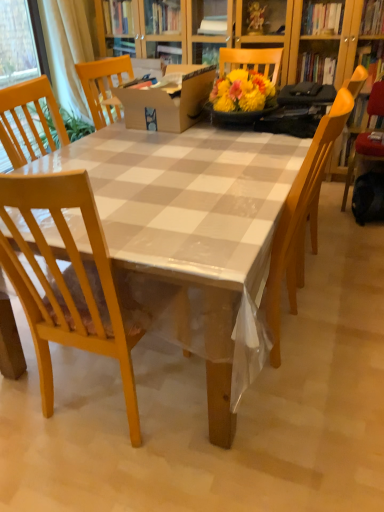
Question: From a real-world perspective, is yellow wood chair at right, placed as the first chair when sorted from right to left, physically below white sheer curtain at upper left?

Choices:
 (A) no
 (B) yes

Answer: (B)

Question: Is yellow wood chair at right, the third chair in the front-to-back sequence, in contact with white sheer curtain at upper left?

Choices:
 (A) no
 (B) yes

Answer: (A)

Question: Can you confirm if yellow wood chair at right, which appears as the 1th chair when viewed from the back, is shorter than white sheer curtain at upper left?

Choices:
 (A) no
 (B) yes

Answer: (B)

Question: Is the position of yellow wood chair at right, placed as the first chair when sorted from right to left, less distant than that of white sheer curtain at upper left?

Choices:
 (A) yes
 (B) no

Answer: (A)

Question: From a real-world perspective, is yellow wood chair at right, placed as the first chair when sorted from right to left, on white sheer curtain at upper left?

Choices:
 (A) yes
 (B) no

Answer: (B)

Question: Is yellow wood chair at right, which appears as the 1th chair when viewed from the back, at the left side of white sheer curtain at upper left?

Choices:
 (A) yes
 (B) no

Answer: (B)

Question: From a real-world perspective, is yellow wood chair at right, the third chair in the front-to-back sequence, on wooden chair at center, which appears as the second chair when viewed from the left?

Choices:
 (A) no
 (B) yes

Answer: (A)

Question: Is yellow wood chair at right, which appears as the 1th chair when viewed from the back, turned away from wooden chair at center, which appears as the second chair when viewed from the left?

Choices:
 (A) no
 (B) yes

Answer: (A)

Question: Considering the relative sizes of yellow wood chair at right, the 3th chair when ordered from left to right, and wooden chair at center, which appears as the second chair when viewed from the right, in the image provided, is yellow wood chair at right, the 3th chair when ordered from left to right, bigger than wooden chair at center, which appears as the second chair when viewed from the right,?

Choices:
 (A) yes
 (B) no

Answer: (B)

Question: Is yellow wood chair at right, placed as the first chair when sorted from right to left, positioned behind wooden chair at center, placed as the 2th chair when sorted from back to front?

Choices:
 (A) no
 (B) yes

Answer: (B)

Question: Can you confirm if yellow wood chair at right, which appears as the 1th chair when viewed from the back, is wider than wooden chair at center, which appears as the second chair when viewed from the right?

Choices:
 (A) no
 (B) yes

Answer: (B)

Question: Is wooden chair at center, which appears as the second chair when viewed from the right, a part of yellow wood chair at right, placed as the first chair when sorted from right to left?

Choices:
 (A) yes
 (B) no

Answer: (B)

Question: Is light wood chair at left, positioned as the third chair in right-to-left order, turned away from wooden chair at center, which appears as the second chair when viewed from the left?

Choices:
 (A) yes
 (B) no

Answer: (B)